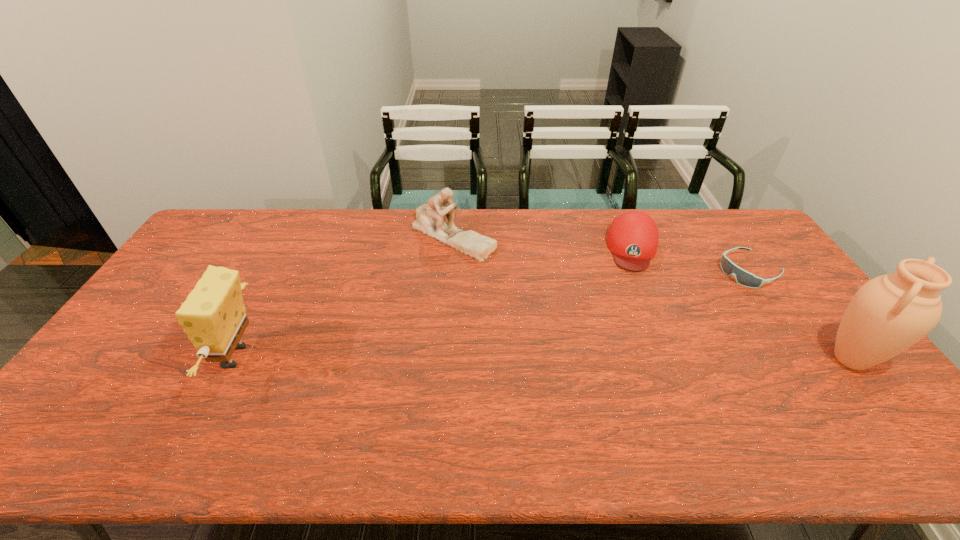
I want to click on free spot between the urn and the leftmost object, so click(543, 358).

This screenshot has width=960, height=540. I want to click on free area in between the leftmost object and the tallest object, so click(543, 358).

Find the location of `unoccupied position between the leftmost object and the urn`. unoccupied position between the leftmost object and the urn is located at coordinates (543, 358).

Where is `object that stands as the fourth closest to the second object from left to right`? object that stands as the fourth closest to the second object from left to right is located at coordinates click(x=888, y=314).

Select which object is the third closest to the goggles. Please provide its 2D coordinates. Your answer should be formatted as a tuple, i.e. [(x, y)], where the tuple contains the x and y coordinates of a point satisfying the conditions above.

[(430, 220)]